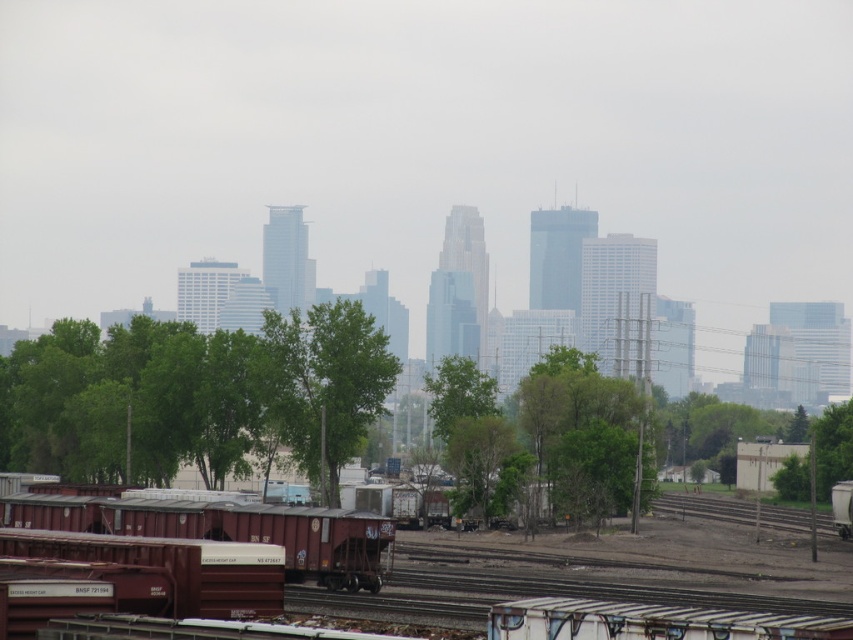
Who is more forward, (364, 435) or (848, 422)?

Point (364, 435) is more forward.

This screenshot has width=853, height=640. What do you see at coordinates (326, 385) in the screenshot? I see `green leafy tree at center` at bounding box center [326, 385].

Identify the location of green leafy tree at center. The image size is (853, 640). (326, 385).

Identify the location of green leafy tree at center. This screenshot has height=640, width=853. (326, 385).

In the scene shown: Measure the distance from green leafy tree at lower center to green leafy tree at center-right.

green leafy tree at lower center is 30.39 meters from green leafy tree at center-right.

Does green leafy tree at lower center appear on the right side of green leafy tree at center-right?

In fact, green leafy tree at lower center is to the left of green leafy tree at center-right.

Which is behind, point (622, 451) or point (799, 486)?

Positioned behind is point (799, 486).

Where is `green leafy tree at lower center`? The height and width of the screenshot is (640, 853). green leafy tree at lower center is located at coordinates (195, 397).

Between green leafy tree at center and rusty metal train car at lower left, which one has more height?

green leafy tree at center is taller.

This screenshot has width=853, height=640. Find the location of `green leafy tree at center`. green leafy tree at center is located at coordinates (326, 385).